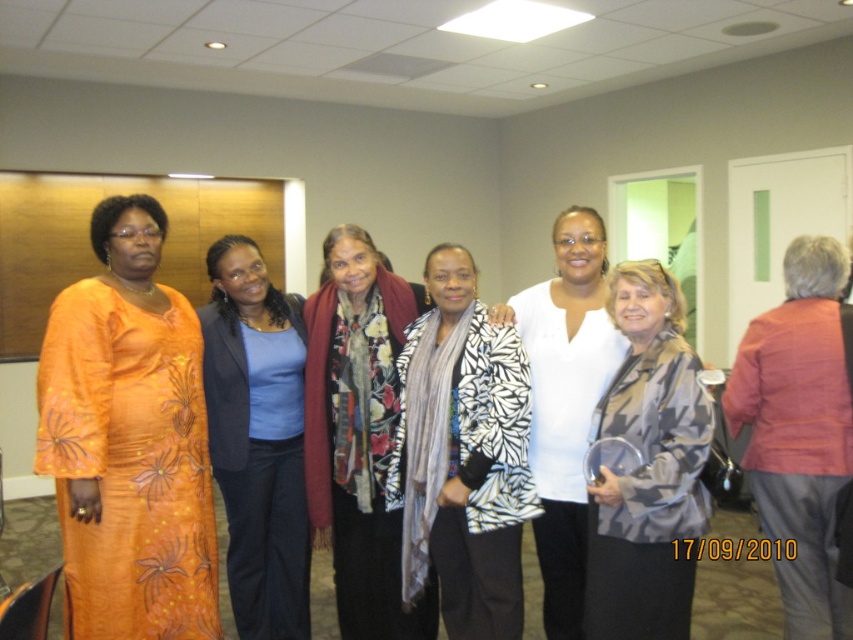
Consider the image. Can you confirm if camouflage-patterned jacket at center is taller than white matte shirt at center?

No.

Consider the image. Which of these two, camouflage-patterned jacket at center or white matte shirt at center, stands shorter?

camouflage-patterned jacket at center is shorter.

Image resolution: width=853 pixels, height=640 pixels. Find the location of `camouflage-patterned jacket at center`. camouflage-patterned jacket at center is located at coordinates pyautogui.click(x=648, y=467).

Which of these two, orange floral dress at left or matte pink blazer at right, stands shorter?

matte pink blazer at right is shorter.

Where is `orange floral dress at left`? orange floral dress at left is located at coordinates click(128, 440).

Which is in front, point (635, 612) or point (257, 422)?

Point (635, 612) is more forward.

Describe the element at coordinates (648, 467) in the screenshot. I see `camouflage-patterned jacket at center` at that location.

Who is more distant from viewer, (697, 472) or (299, 550)?

Point (299, 550)

The width and height of the screenshot is (853, 640). Identify the location of camouflage-patterned jacket at center. (648, 467).